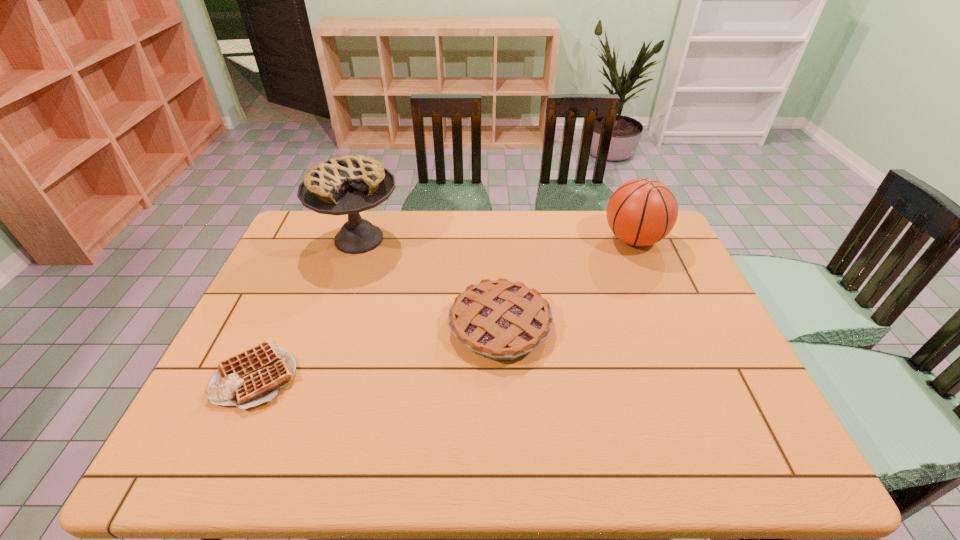
Image resolution: width=960 pixels, height=540 pixels. I want to click on the tallest object, so click(x=351, y=184).

The height and width of the screenshot is (540, 960). In order to click on the left pie in this screenshot , I will do `click(351, 184)`.

Where is `the rightmost object`? The height and width of the screenshot is (540, 960). the rightmost object is located at coordinates (641, 212).

You are a GUI agent. You are given a task and a screenshot of the screen. Output one action in this format:
    pyautogui.click(x=<x>, y=<y>)
    Task: Click on the basketball
    This screenshot has width=960, height=540.
    Given the screenshot: What is the action you would take?
    pyautogui.click(x=641, y=212)

Where is `the nearer pie`? Image resolution: width=960 pixels, height=540 pixels. the nearer pie is located at coordinates (498, 319).

The image size is (960, 540). What are the coordinates of `the right pie` in the screenshot? It's located at (498, 319).

Where is `waffle`? waffle is located at coordinates (250, 378).

In order to click on blank space located 0.170m on the cut side of the left pie in this screenshot , I will do `click(336, 307)`.

Locate an element on the screen. blank space located on the front of the basketball is located at coordinates (669, 323).

Identify the location of vacant space located on the front of the right pie. Image resolution: width=960 pixels, height=540 pixels. (506, 466).